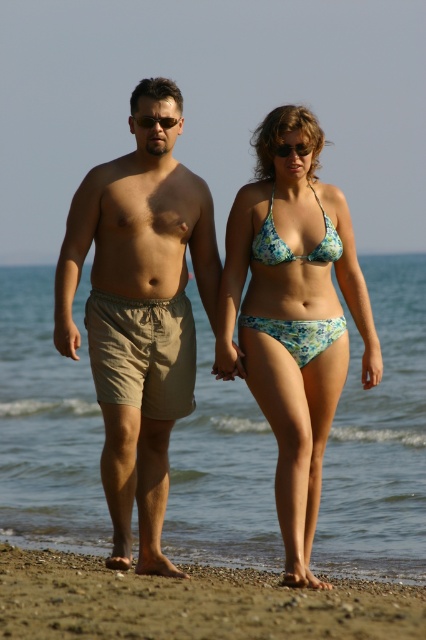
Question: Can you confirm if clear blue water at center is positioned to the left of green plastic sunglasses at center?

Choices:
 (A) no
 (B) yes

Answer: (B)

Question: Which of these objects is positioned closest to the black plastic sunglasses at center?

Choices:
 (A) floral bikini at center
 (B) green plastic sunglasses at center

Answer: (B)

Question: Estimate the real-world distances between objects in this image. Which object is farther from the tan fabric shorts at left?

Choices:
 (A) brown sand at lower center
 (B) floral print fabric bikini at center
 (C) floral print bikini top at center

Answer: (A)

Question: Can you confirm if tan fabric shorts at left is positioned to the left of brown sand at lower center?

Choices:
 (A) yes
 (B) no

Answer: (A)

Question: Is clear blue water at center above green plastic sunglasses at center?

Choices:
 (A) yes
 (B) no

Answer: (B)

Question: Which point is closer to the camera taking this photo?

Choices:
 (A) (311, 348)
 (B) (302, 147)

Answer: (A)